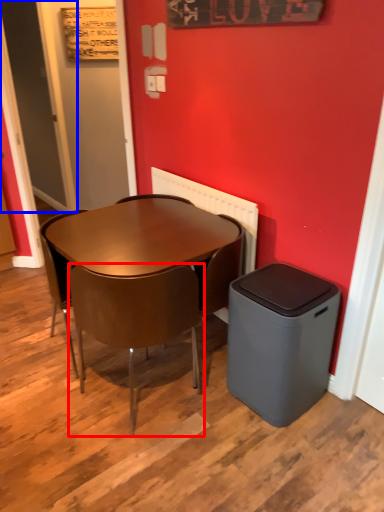
Question: Among these objects, which one is nearest to the camera, chair (highlighted by a red box) or door (highlighted by a blue box)?

Choices:
 (A) chair
 (B) door

Answer: (A)